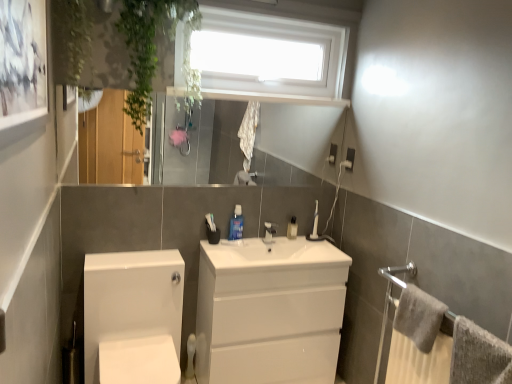
Question: Does white plastic window at upper center have a greater width compared to white ceramic tap at center?

Choices:
 (A) no
 (B) yes

Answer: (B)

Question: Does white plastic window at upper center have a larger size compared to white ceramic tap at center?

Choices:
 (A) no
 (B) yes

Answer: (B)

Question: Can you confirm if white plastic window at upper center is positioned to the right of white ceramic tap at center?

Choices:
 (A) no
 (B) yes

Answer: (A)

Question: Could white ceramic tap at center be considered to be inside white plastic window at upper center?

Choices:
 (A) no
 (B) yes

Answer: (A)

Question: Is white plastic window at upper center not close to white ceramic tap at center?

Choices:
 (A) no
 (B) yes

Answer: (B)

Question: From a real-world perspective, is white plastic window at upper center on white ceramic tap at center?

Choices:
 (A) no
 (B) yes

Answer: (B)

Question: Is white plastic window at upper center smaller than white plastic toothbrush at center, which is the second toiletry in front-to-back order?

Choices:
 (A) yes
 (B) no

Answer: (B)

Question: Is white plastic toothbrush at center, placed as the first toiletry when sorted from right to left, at the back of white plastic window at upper center?

Choices:
 (A) no
 (B) yes

Answer: (A)

Question: Is white plastic window at upper center at the right side of white plastic toothbrush at center, which is counted as the 2th toiletry, starting from the left?

Choices:
 (A) no
 (B) yes

Answer: (A)

Question: Is white plastic window at upper center touching white plastic toothbrush at center, which ranks as the 1th toiletry in back-to-front order?

Choices:
 (A) no
 (B) yes

Answer: (A)

Question: Considering the relative sizes of white plastic window at upper center and white plastic toothbrush at center, which is the second toiletry in front-to-back order, in the image provided, is white plastic window at upper center thinner than white plastic toothbrush at center, which is the second toiletry in front-to-back order,?

Choices:
 (A) yes
 (B) no

Answer: (B)

Question: Is the depth of white plastic window at upper center greater than that of white plastic toothbrush at center, placed as the first toiletry when sorted from right to left?

Choices:
 (A) no
 (B) yes

Answer: (A)

Question: Does white ceramic tap at center have a greater height compared to blue glossy mouthwash at center, which ranks as the first toiletry in left-to-right order?

Choices:
 (A) no
 (B) yes

Answer: (A)